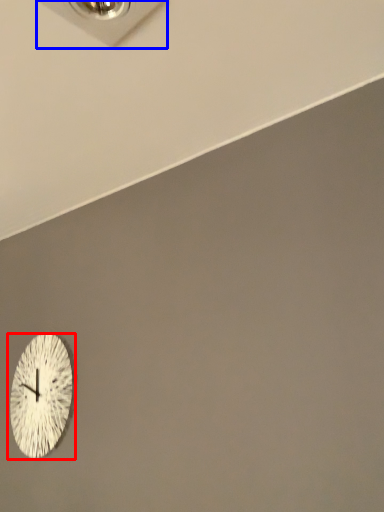
Question: Which point is further to the camera, wall clock (highlighted by a red box) or electric outlet (highlighted by a blue box)?

Choices:
 (A) wall clock
 (B) electric outlet

Answer: (A)